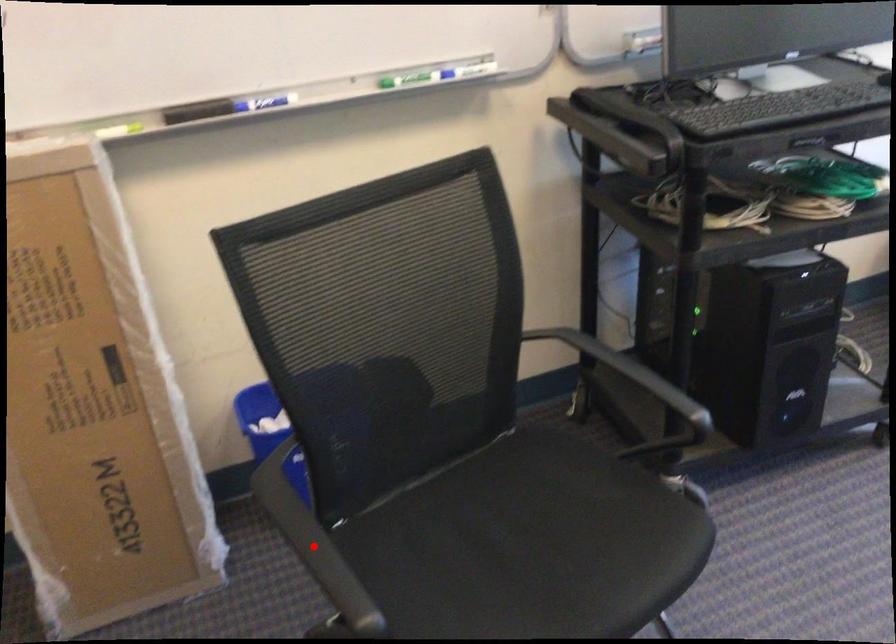
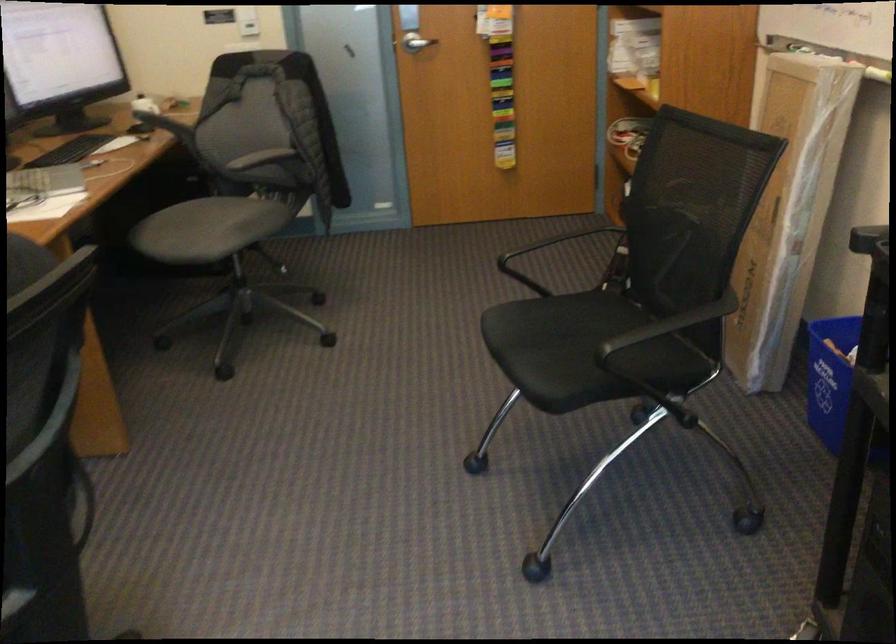
Question: I am providing you with two images of the same scene from different viewpoints. A red point is marked on the first image. Is the red point's position out of view in image 2?

Choices:
 (A) Yes
 (B) No

Answer: (A)